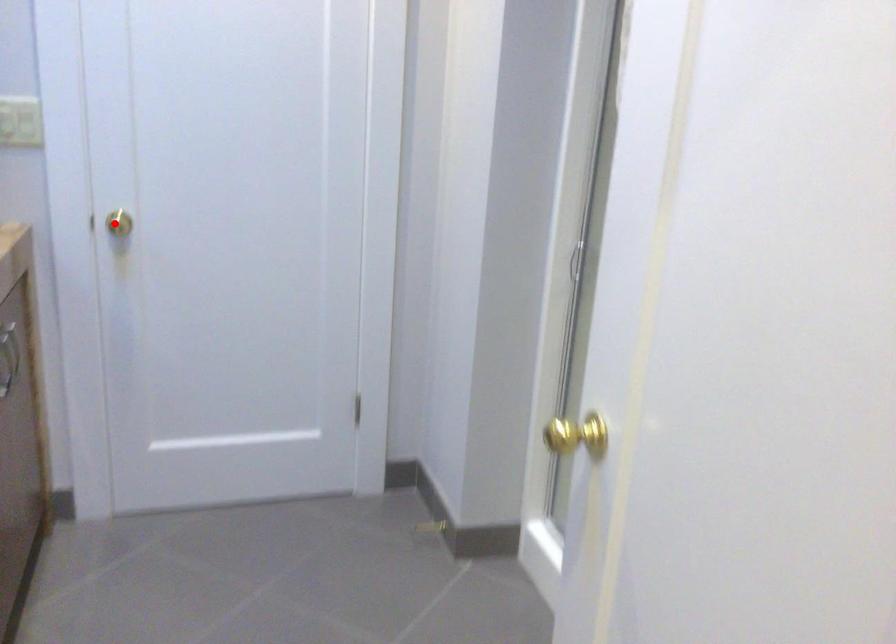
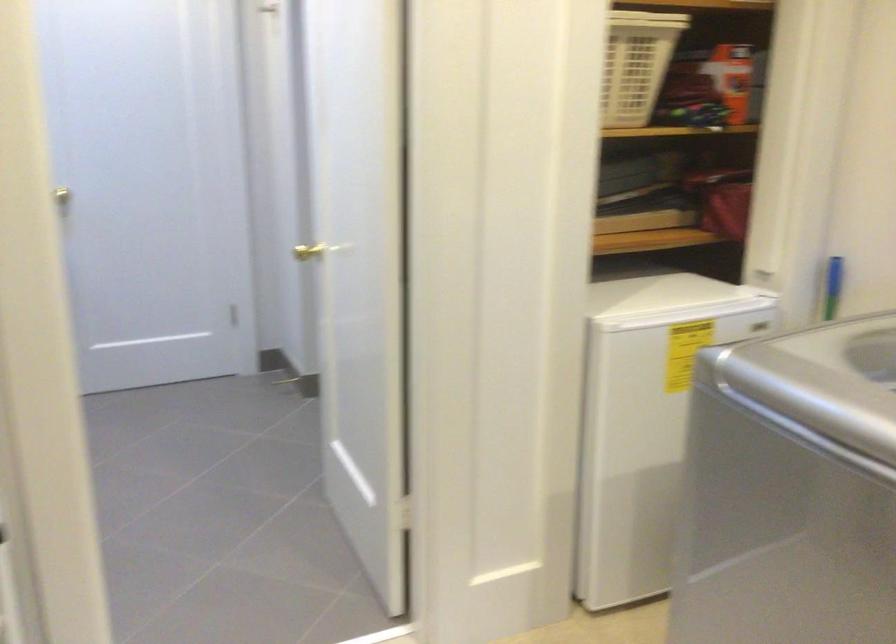
Where in the second image is the point corresponding to the highlighted location from the first image?

(71, 192)